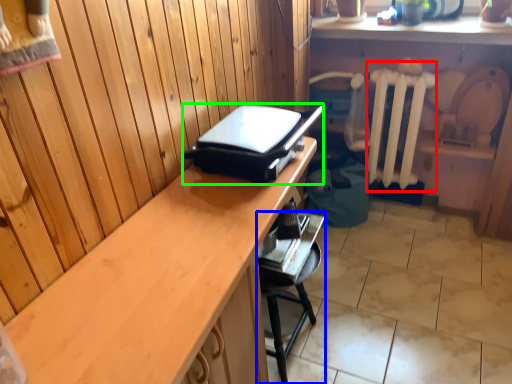
Question: Which object is positioned closest to radiator (highlighted by a red box)? Select from furniture (highlighted by a blue box) and appliance (highlighted by a green box).

Choices:
 (A) furniture
 (B) appliance

Answer: (A)